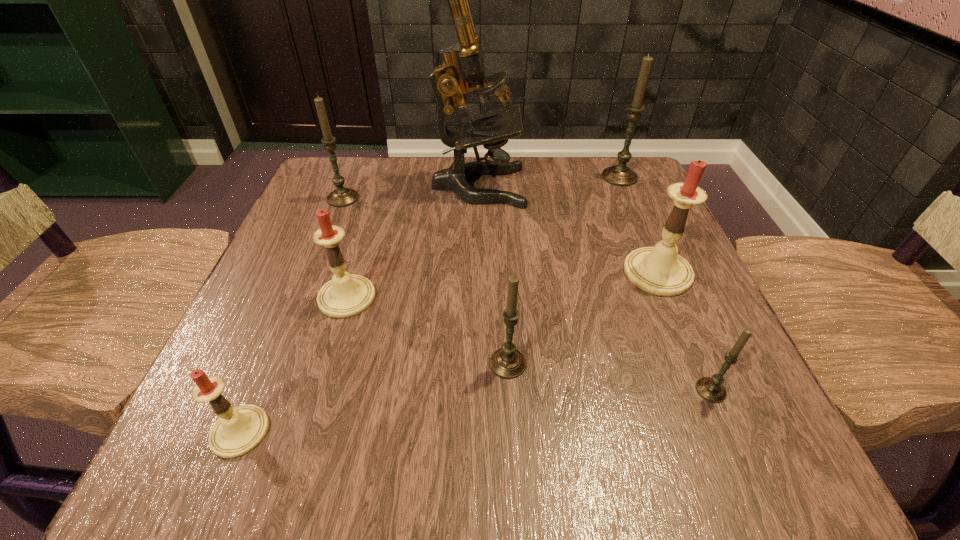
Locate an element on the screen. The width and height of the screenshot is (960, 540). microscope positioned at the far edge is located at coordinates (462, 62).

I want to click on object present at the near edge, so tap(239, 430).

The width and height of the screenshot is (960, 540). I want to click on object located at the far left corner, so 340,197.

Identify the location of object positioned at the near left corner. (239, 430).

Where is `object located in the far right corner section of the desktop`? This screenshot has height=540, width=960. object located in the far right corner section of the desktop is located at coordinates (620, 175).

Identify the location of free space at the far edge of the desktop. The width and height of the screenshot is (960, 540). (531, 159).

In order to click on vacant point at the near edge in this screenshot , I will do `click(395, 467)`.

Image resolution: width=960 pixels, height=540 pixels. In the image, there is a desktop. Find the location of `free space at the left edge`. free space at the left edge is located at coordinates (287, 235).

The width and height of the screenshot is (960, 540). I want to click on vacant space at the right edge of the desktop, so click(666, 401).

Identify the location of vacant position at the far right corner of the desktop. (583, 160).